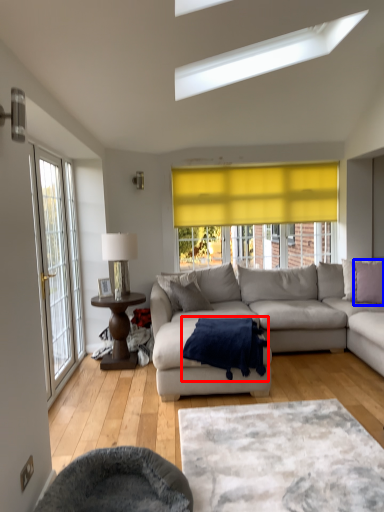
Question: Which object is further to the camera taking this photo, blanket (highlighted by a red box) or pillow (highlighted by a blue box)?

Choices:
 (A) blanket
 (B) pillow

Answer: (B)